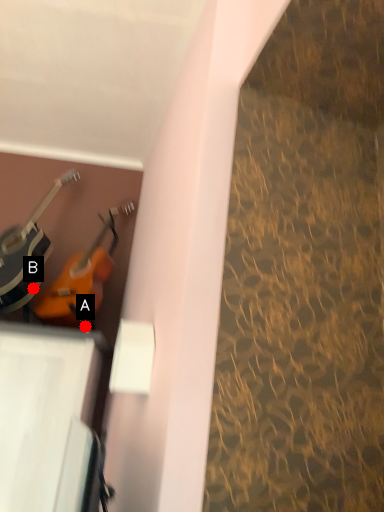
Question: Two points are circled on the image, labeled by A and B beside each circle. Which point is closer to the camera?

Choices:
 (A) A is closer
 (B) B is closer

Answer: (B)